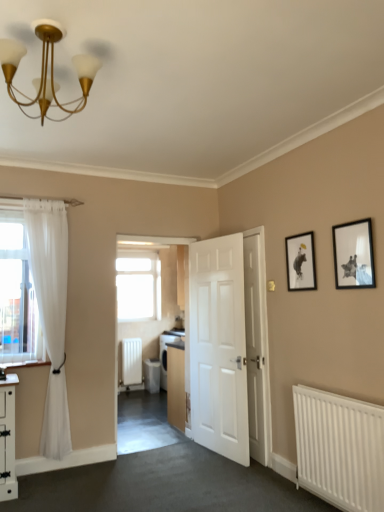
Identify the location of transparent glass window at center. (138, 285).

Describe the element at coordinates (47, 71) in the screenshot. I see `gold metallic chandelier at upper left` at that location.

What is the approximate height of gold metallic chandelier at upper left?

gold metallic chandelier at upper left is 16.25 inches in height.

What is the approximate height of white smooth door at center, which is counted as the first door, starting from the right?

The height of white smooth door at center, which is counted as the first door, starting from the right, is 1.95 meters.

The image size is (384, 512). Describe the element at coordinates (340, 449) in the screenshot. I see `white metallic radiator at lower right, which appears as the first radiator when viewed from the right` at that location.

Locate an element on the screen. The width and height of the screenshot is (384, 512). transparent glass window at center is located at coordinates tap(138, 285).

From the image's perspective, relative to white smooth door at center, which is counted as the first door, starting from the right, is white matte door at center, the first door from the left, above or below?

white matte door at center, the first door from the left, is below white smooth door at center, which is counted as the first door, starting from the right.

Is white matte door at center, the first door from the left, looking in the opposite direction of white smooth door at center, placed as the 2th door when sorted from left to right?

Absolutely, white matte door at center, the first door from the left, is directed away from white smooth door at center, placed as the 2th door when sorted from left to right.

Who is taller, white matte door at center, the 2th door viewed from the right, or white smooth door at center, placed as the 2th door when sorted from left to right?

white matte door at center, the 2th door viewed from the right, is taller.

Which object is further away from the camera taking this photo, white matte door at center, the first door from the left, or white smooth door at center, which is counted as the first door, starting from the right?

white smooth door at center, which is counted as the first door, starting from the right, is further away from the camera.

Is matte black picture frame at upper right, which ranks as the 1th picture frame in back-to-front order, closer to camera compared to white glossy dishwasher at center?

Yes.

Is matte black picture frame at upper right, the 2th picture frame positioned from the front, looking in the opposite direction of white glossy dishwasher at center?

No, white glossy dishwasher at center is not at the back of matte black picture frame at upper right, the 2th picture frame positioned from the front.

Considering the sizes of objects matte black picture frame at upper right, the 2th picture frame positioned from the front, and white glossy dishwasher at center in the image provided, who is thinner, matte black picture frame at upper right, the 2th picture frame positioned from the front, or white glossy dishwasher at center?

Thinner between the two is matte black picture frame at upper right, the 2th picture frame positioned from the front.

Do you think matte black picture frame at upper right, which is the 1th picture frame from left to right, is within white glossy dishwasher at center, or outside of it?

matte black picture frame at upper right, which is the 1th picture frame from left to right, exists outside the volume of white glossy dishwasher at center.

Does white matte door at center, the 2th door viewed from the right, come behind transparent glass window at center?

No, it is not.

Is white matte door at center, the 2th door viewed from the right, oriented towards transparent glass window at center?

No, white matte door at center, the 2th door viewed from the right, is not facing towards transparent glass window at center.

Would you say white matte door at center, the first door from the left, is inside or outside transparent glass window at center?

white matte door at center, the first door from the left, is spatially situated outside transparent glass window at center.

From a real-world perspective, is sheer white curtain at left physically located above or below gold metallic chandelier at upper left?

sheer white curtain at left is situated lower than gold metallic chandelier at upper left in the real world.

Which of these two, sheer white curtain at left or gold metallic chandelier at upper left, is smaller?

gold metallic chandelier at upper left is smaller.

Find the location of a particular element. curtain below the gold metallic chandelier at upper left (from a real-world perspective) is located at coordinates (51, 313).

Is matte black picture frame at upper right, the 2th picture frame positioned from the front, not close to white matte door at center, the 2th door viewed from the right?

No, there isn't a large distance between matte black picture frame at upper right, the 2th picture frame positioned from the front, and white matte door at center, the 2th door viewed from the right.

Does matte black picture frame at upper right, which is the 1th picture frame from left to right, have a greater height compared to white matte door at center, the first door from the left?

No, matte black picture frame at upper right, which is the 1th picture frame from left to right, is not taller than white matte door at center, the first door from the left.

From the image's perspective, would you say matte black picture frame at upper right, the 2th picture frame positioned from the front, is positioned over white matte door at center, the 2th door viewed from the right?

Indeed, from the image's perspective, matte black picture frame at upper right, the 2th picture frame positioned from the front, is shown above white matte door at center, the 2th door viewed from the right.

Is white metallic radiator at lower right, the 2th radiator viewed from the back, further to camera compared to sheer white curtain at left?

No.

Is sheer white curtain at left located within white metallic radiator at lower right, which appears as the first radiator when viewed from the right?

No, white metallic radiator at lower right, which appears as the first radiator when viewed from the right, does not contain sheer white curtain at left.

Could you tell me if white metallic radiator at lower right, the 1th radiator when ordered from front to back, is facing sheer white curtain at left?

No, white metallic radiator at lower right, the 1th radiator when ordered from front to back, is not turned towards sheer white curtain at left.

You are a GUI agent. You are given a task and a screenshot of the screen. Output one action in this format:
    pyautogui.click(x=<x>, y=<y>)
    Task: Click on the radiator located in front of the sheer white curtain at left
    
    Given the screenshot: What is the action you would take?
    pyautogui.click(x=340, y=449)

From a real-world perspective, is white glossy dishwasher at center physically above matte black picture frame at upper right, which ranks as the 1th picture frame in back-to-front order?

No, from a real-world perspective, white glossy dishwasher at center is not on top of matte black picture frame at upper right, which ranks as the 1th picture frame in back-to-front order.

From the image's perspective, is white glossy dishwasher at center above or below matte black picture frame at upper right, which ranks as the 1th picture frame in back-to-front order?

Based on their image positions, white glossy dishwasher at center is located beneath matte black picture frame at upper right, which ranks as the 1th picture frame in back-to-front order.

Is white glossy dishwasher at center taller or shorter than matte black picture frame at upper right, the 2th picture frame positioned from the front?

white glossy dishwasher at center is taller than matte black picture frame at upper right, the 2th picture frame positioned from the front.

In order to click on door above the white matte door at center, the first door from the left (from the image's perspective) in this screenshot , I will do `click(255, 342)`.

What are the coordinates of `dish washer that is on the left side of matte black picture frame at upper right, which is the 1th picture frame from left to right` in the screenshot? It's located at (152, 375).

When comparing their distances from white matte door at center, the 2th door viewed from the right, does white metallic radiator at lower right, the 1th radiator when ordered from front to back, or white smooth door at center, which is counted as the first door, starting from the right, seem closer?

white smooth door at center, which is counted as the first door, starting from the right, is positioned closer to the anchor white matte door at center, the 2th door viewed from the right.

When comparing their distances from transparent glass window at center, does gold metallic chandelier at upper left or matte black picture frame at upper right, which ranks as the 1th picture frame in back-to-front order, seem further?

gold metallic chandelier at upper left.

When comparing their distances from white matte radiator at center, which is the 1th radiator from left to right, does sheer white curtain at left or matte black picture frame at upper right, the 2th picture frame positioned from the front, seem further?

matte black picture frame at upper right, the 2th picture frame positioned from the front, is further to white matte radiator at center, which is the 1th radiator from left to right.

When comparing their distances from white glossy dishwasher at center, does white matte radiator at center, arranged as the 2th radiator when viewed from the front, or matte black picture frame at upper right, which is counted as the 2th picture frame, starting from the right, seem further?

The object further to white glossy dishwasher at center is matte black picture frame at upper right, which is counted as the 2th picture frame, starting from the right.

When comparing their distances from sheer white curtain at left, does white metallic radiator at lower right, the 1th radiator when ordered from front to back, or white matte door at center, the 2th door viewed from the right, seem further?

Based on the image, white metallic radiator at lower right, the 1th radiator when ordered from front to back, appears to be further to sheer white curtain at left.

Looking at the image, which one is located further to black matte picture frame at upper right, which is the second picture frame from back to front, transparent glass window at center or white smooth door at center, which is counted as the first door, starting from the right?

Among the two, transparent glass window at center is located further to black matte picture frame at upper right, which is the second picture frame from back to front.

Which object lies further to the anchor point white metallic radiator at lower right, positioned as the second radiator in left-to-right order, transparent glass window at center or white matte door at center, the 2th door viewed from the right?

transparent glass window at center is further to white metallic radiator at lower right, positioned as the second radiator in left-to-right order.

When comparing their distances from transparent glass window at center, does white matte door at center, the 2th door viewed from the right, or black matte picture frame at upper right, acting as the 1th picture frame starting from the front, seem closer?

white matte door at center, the 2th door viewed from the right, is positioned closer to the anchor transparent glass window at center.

Identify the location of radiator between black matte picture frame at upper right, the 1th picture frame from the right, and transparent glass window at center, along the z-axis. This screenshot has width=384, height=512. (132, 361).

Locate an element on the screen. picture frame that lies between black matte picture frame at upper right, the 1th picture frame from the right, and white metallic radiator at lower right, the 1th radiator when ordered from front to back, from top to bottom is located at coordinates (300, 262).

Image resolution: width=384 pixels, height=512 pixels. I want to click on dish washer positioned between black matte picture frame at upper right, the 1th picture frame from the right, and transparent glass window at center from near to far, so 152,375.

This screenshot has height=512, width=384. Identify the location of picture frame between black matte picture frame at upper right, acting as the 1th picture frame starting from the front, and transparent glass window at center from front to back. (300, 262).